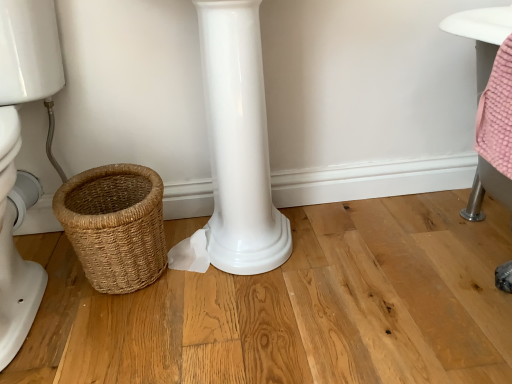
Question: Is white glossy toilet at left taller or shorter than braided wicker basket at lower left?

Choices:
 (A) tall
 (B) short

Answer: (A)

Question: Looking at the image, does white glossy toilet at left seem bigger or smaller compared to braided wicker basket at lower left?

Choices:
 (A) big
 (B) small

Answer: (A)

Question: Relative to braided wicker basket at lower left, is white glossy toilet at left in front or behind?

Choices:
 (A) front
 (B) behind

Answer: (A)

Question: Considering the positions of braided wicker basket at lower left and white glossy toilet at left in the image, is braided wicker basket at lower left bigger or smaller than white glossy toilet at left?

Choices:
 (A) small
 (B) big

Answer: (A)

Question: Is braided wicker basket at lower left in front of or behind white glossy toilet at left in the image?

Choices:
 (A) front
 (B) behind

Answer: (B)

Question: Considering the positions of braided wicker basket at lower left and white glossy toilet at left in the image, is braided wicker basket at lower left taller or shorter than white glossy toilet at left?

Choices:
 (A) short
 (B) tall

Answer: (A)

Question: Which is correct: braided wicker basket at lower left is inside white glossy toilet at left, or outside of it?

Choices:
 (A) inside
 (B) outside

Answer: (B)